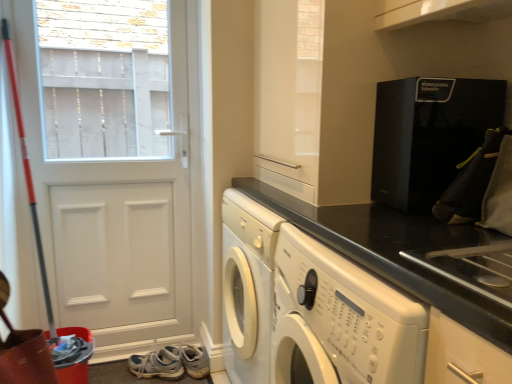
Question: From the image's perspective, is white leather shoe at lower left over white matte door at left?

Choices:
 (A) yes
 (B) no

Answer: (B)

Question: Does white leather shoe at lower left have a lesser width compared to white matte door at left?

Choices:
 (A) no
 (B) yes

Answer: (A)

Question: From a real-world perspective, is white leather shoe at lower left on top of white matte door at left?

Choices:
 (A) no
 (B) yes

Answer: (A)

Question: Is white leather shoe at lower left to the left of white matte door at left from the viewer's perspective?

Choices:
 (A) yes
 (B) no

Answer: (B)

Question: From a real-world perspective, is white leather shoe at lower left positioned under white matte door at left based on gravity?

Choices:
 (A) no
 (B) yes

Answer: (B)

Question: Do you think white matte door at left is within black granite countertop at center, or outside of it?

Choices:
 (A) inside
 (B) outside

Answer: (B)

Question: In the image, is white matte door at left positioned in front of or behind black granite countertop at center?

Choices:
 (A) front
 (B) behind

Answer: (B)

Question: Is white matte door at left bigger or smaller than black granite countertop at center?

Choices:
 (A) big
 (B) small

Answer: (B)

Question: Considering the positions of white matte door at left and black granite countertop at center in the image, is white matte door at left taller or shorter than black granite countertop at center?

Choices:
 (A) short
 (B) tall

Answer: (B)

Question: Choose the correct answer: Is black textured coffee machine at upper right inside white matte door at left or outside it?

Choices:
 (A) outside
 (B) inside

Answer: (A)

Question: Relative to white matte door at left, is black textured coffee machine at upper right in front or behind?

Choices:
 (A) behind
 (B) front

Answer: (B)

Question: Does point (436, 145) appear closer or farther from the camera than point (197, 206)?

Choices:
 (A) farther
 (B) closer

Answer: (B)

Question: Is black textured coffee machine at upper right bigger or smaller than white matte door at left?

Choices:
 (A) big
 (B) small

Answer: (B)

Question: From a real-world perspective, is black textured coffee machine at upper right above or below black granite countertop at center?

Choices:
 (A) below
 (B) above

Answer: (B)

Question: Is black textured coffee machine at upper right wider or thinner than black granite countertop at center?

Choices:
 (A) wide
 (B) thin

Answer: (B)